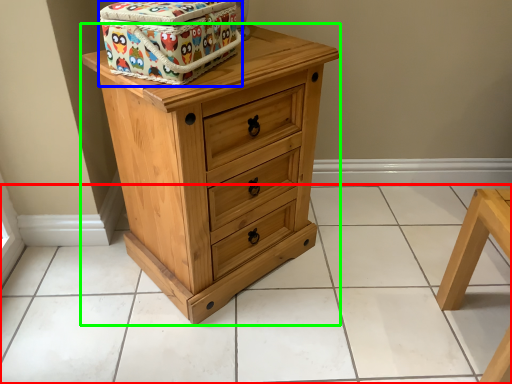
Question: Which object is positioned farthest from tile (highlighted by a red box)? Select from cardboard box (highlighted by a blue box) and chest of drawers (highlighted by a green box).

Choices:
 (A) cardboard box
 (B) chest of drawers

Answer: (A)